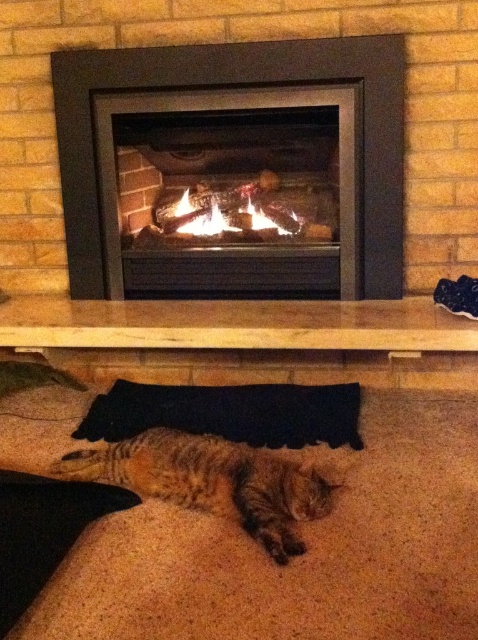
Based on the photo, does tabby fur cat at lower center appear on the right side of orange flame logs at center?

Incorrect, tabby fur cat at lower center is not on the right side of orange flame logs at center.

Which is behind, point (272, 458) or point (203, 193)?

Positioned behind is point (203, 193).

Locate an element on the screen. tabby fur cat at lower center is located at coordinates (213, 481).

Consider the image. Can you confirm if matte black fireplace at center is smaller than tabby fur cat at lower center?

No.

Is matte black fireplace at center to the left of tabby fur cat at lower center from the viewer's perspective?

No, matte black fireplace at center is not to the left of tabby fur cat at lower center.

Which is in front, point (272, 65) or point (206, 468)?

Point (206, 468) is in front.

In order to click on matte black fireplace at center in this screenshot , I will do `click(227, 86)`.

Is matte black fireplace at center thinner than orange flame logs at center?

No, matte black fireplace at center is not thinner than orange flame logs at center.

You are a GUI agent. You are given a task and a screenshot of the screen. Output one action in this format:
    pyautogui.click(x=<x>, y=<y>)
    Task: Click on the matte black fireplace at center
    This screenshot has width=478, height=640.
    Given the screenshot: What is the action you would take?
    pyautogui.click(x=227, y=86)

Does point (361, 225) come closer to viewer compared to point (166, 211)?

Yes.

Identify the location of matte black fireplace at center. The height and width of the screenshot is (640, 478). (227, 86).